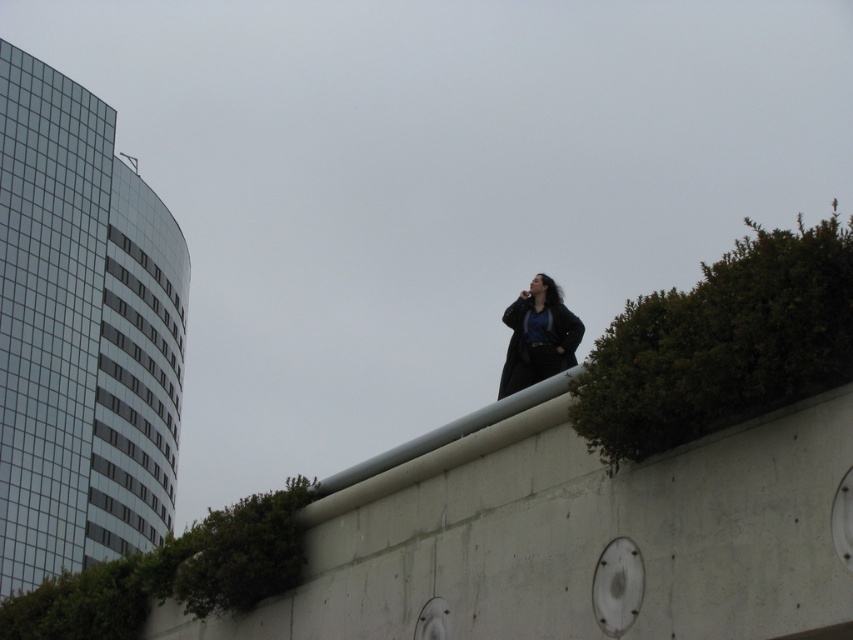
You are standing in front of the concrete wall with the person. You want to place a small statue between the green leafy bush at upper right and the green leafy plant at lower left. Which one is closer to you so the statue can be placed in between them?

The green leafy bush at upper right is closer to the viewer than the green leafy plant at lower left, so place the statue between them near the closer one.

You are a delivery drone with a maximum flight range of 60 feet. You need to deliver a package from the modern building with a curved facade to the green leafy plant at lower left. Can you make the delivery without recharging?

The distance between the modern building with a curved facade and the green leafy plant at lower left is 62.23 feet, which exceeds the drone s 60 feet maximum flight range. Therefore, the drone cannot make the delivery without recharging.

Looking at the scene, where is the green leafy bush at upper right in relation to the green leafy plant at lower left?

The green leafy bush at upper right is to the right of the green leafy plant at lower left.